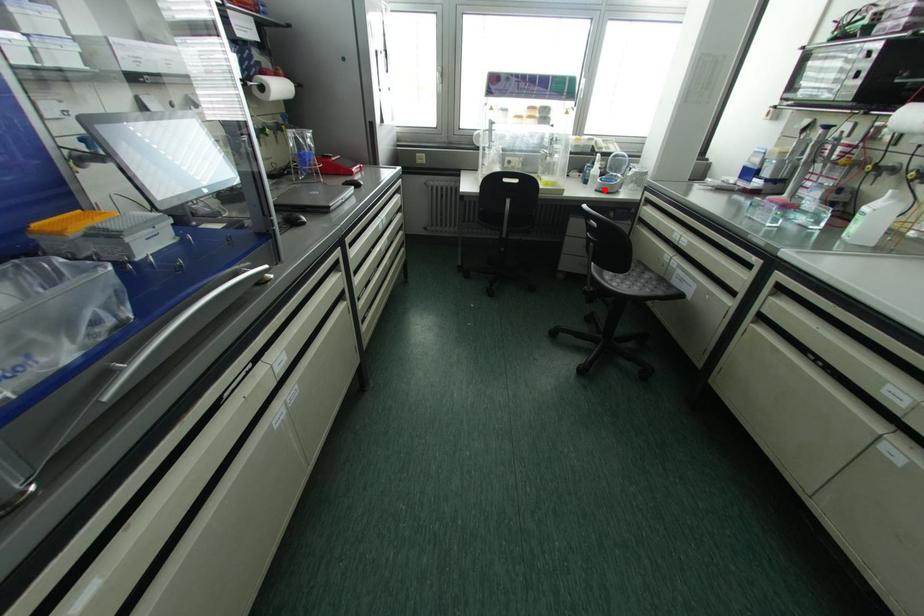
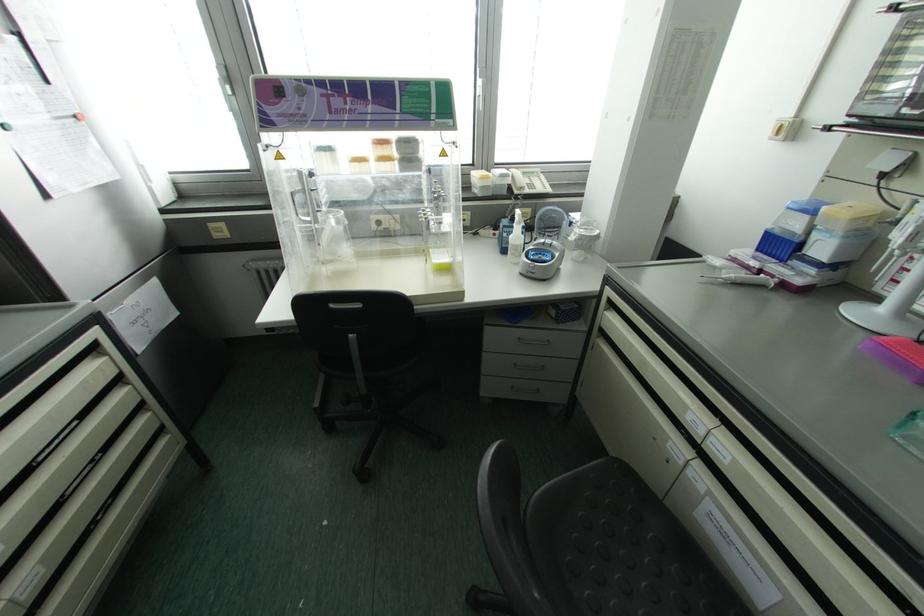
Question: I am providing you with two images of the same scene from different viewpoints. Image1 has a red point marked. In image2, the corresponding 3D location appears at what relative position? Reply with the corresponding letter.

Choices:
 (A) Closer
 (B) Farther

Answer: (A)